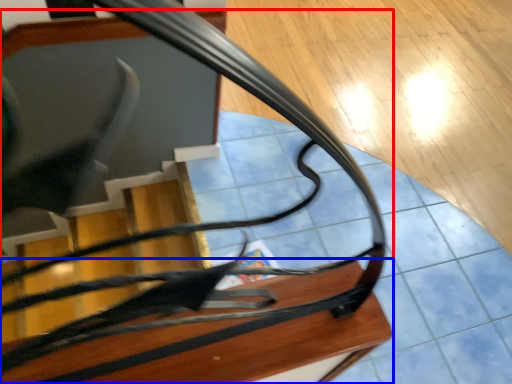
Question: Which object is further to the camera taking this photo, furniture (highlighted by a red box) or table (highlighted by a blue box)?

Choices:
 (A) furniture
 (B) table

Answer: (A)